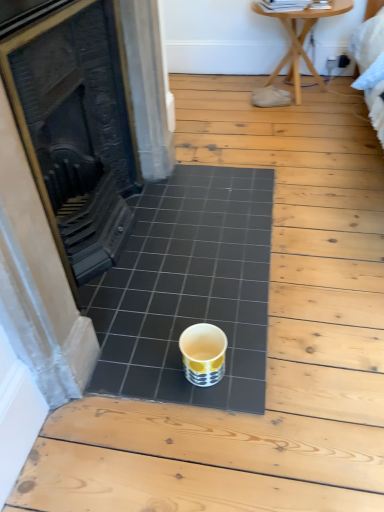
Image resolution: width=384 pixels, height=512 pixels. Identify the location of black cast iron fireplace at center. (76, 131).

The height and width of the screenshot is (512, 384). I want to click on wooden table at upper right, so click(301, 40).

The height and width of the screenshot is (512, 384). Identify the location of black ceramic tile at center. (188, 288).

At what (x,y) coordinates should I click in order to perform the action: click on black cast iron fireplace at center. Please return your answer as a coordinate pair (x, y). This screenshot has height=512, width=384. Looking at the image, I should click on (76, 131).

Is wooden table at upper right at the back of yellow and white ceramic cup at center?

That's not correct — yellow and white ceramic cup at center is not looking away from wooden table at upper right.

Locate an element on the screen. This screenshot has width=384, height=512. coffee cup below the wooden table at upper right (from the image's perspective) is located at coordinates (203, 354).

From a real-world perspective, is yellow and white ceramic cup at center located beneath wooden table at upper right?

Yes, from a real-world perspective, yellow and white ceramic cup at center is beneath wooden table at upper right.

In the scene shown: What's the angular difference between yellow and white ceramic cup at center and wooden table at upper right's facing directions?

They differ by 86.1 degrees in their facing directions.

The image size is (384, 512). In order to click on table on the right of black ceramic tile at center in this screenshot , I will do `click(301, 40)`.

Who is taller, black ceramic tile at center or wooden table at upper right?

wooden table at upper right is taller.

Would you say wooden table at upper right is part of black ceramic tile at center's contents?

No, wooden table at upper right is not a part of black ceramic tile at center.

From the image's perspective, is black ceramic tile at center on top of yellow and white ceramic cup at center?

Correct, black ceramic tile at center appears higher than yellow and white ceramic cup at center in the image.

Is black ceramic tile at center positioned in front of yellow and white ceramic cup at center?

No, the depth of black ceramic tile at center is greater than that of yellow and white ceramic cup at center.

Looking at this image, between black ceramic tile at center and yellow and white ceramic cup at center, which one has larger width?

black ceramic tile at center.

How distant is black ceramic tile at center from yellow and white ceramic cup at center?

black ceramic tile at center and yellow and white ceramic cup at center are 31.44 centimeters apart from each other.

From a real-world perspective, is wooden table at upper right positioned above or below black ceramic tile at center?

wooden table at upper right is situated higher than black ceramic tile at center in the real world.

From the image's perspective, would you say wooden table at upper right is shown under black ceramic tile at center?

Actually, wooden table at upper right appears above black ceramic tile at center in the image.

Considering the relative positions of wooden table at upper right and black ceramic tile at center in the image provided, is wooden table at upper right to the left or to the right of black ceramic tile at center?

From the image, it's evident that wooden table at upper right is to the right of black ceramic tile at center.

Does point (97, 313) come in front of point (91, 222)?

Yes, it is in front of point (91, 222).

From a real-world perspective, is black ceramic tile at center positioned above or below black cast iron fireplace at center?

Clearly, from a real-world perspective, black ceramic tile at center is below black cast iron fireplace at center.

Is black ceramic tile at center to the right of black cast iron fireplace at center from the viewer's perspective?

Yes, black ceramic tile at center is to the right of black cast iron fireplace at center.

Can you tell me how much black ceramic tile at center and black cast iron fireplace at center differ in facing direction?

The angle between the facing direction of black ceramic tile at center and the facing direction of black cast iron fireplace at center is 0.98 degrees.

Is wooden table at upper right located within black cast iron fireplace at center?

No, black cast iron fireplace at center does not contain wooden table at upper right.

From a real-world perspective, is black cast iron fireplace at center above or below wooden table at upper right?

black cast iron fireplace at center is situated higher than wooden table at upper right in the real world.

This screenshot has height=512, width=384. What are the coordinates of `fireplace lying on the left of wooden table at upper right` in the screenshot? It's located at (76, 131).

Is black cast iron fireplace at center oriented towards wooden table at upper right?

No, black cast iron fireplace at center is not aimed at wooden table at upper right.

Is point (222, 340) less distant than point (255, 306)?

Yes, point (222, 340) is closer to viewer.

Is the position of yellow and white ceramic cup at center more distant than that of black ceramic tile at center?

No, yellow and white ceramic cup at center is closer to the viewer.

Could you tell me if yellow and white ceramic cup at center is facing black ceramic tile at center?

No, yellow and white ceramic cup at center does not turn towards black ceramic tile at center.

Is yellow and white ceramic cup at center to the right of black ceramic tile at center from the viewer's perspective?

Indeed, yellow and white ceramic cup at center is positioned on the right side of black ceramic tile at center.

Where is `coffee cup that is in front of the wooden table at upper right`? This screenshot has height=512, width=384. coffee cup that is in front of the wooden table at upper right is located at coordinates (203, 354).

Find the location of a particular element. table behind the black ceramic tile at center is located at coordinates (301, 40).

From the image, which object appears to be farther from yellow and white ceramic cup at center, black ceramic tile at center or black cast iron fireplace at center?

Based on the image, black cast iron fireplace at center appears to be further to yellow and white ceramic cup at center.

When comparing their distances from black ceramic tile at center, does black cast iron fireplace at center or wooden table at upper right seem closer?

Among the two, black cast iron fireplace at center is located nearer to black ceramic tile at center.

Estimate the real-world distances between objects in this image. Which object is closer to black ceramic tile at center, yellow and white ceramic cup at center or wooden table at upper right?

yellow and white ceramic cup at center is positioned closer to the anchor black ceramic tile at center.

When comparing their distances from black ceramic tile at center, does yellow and white ceramic cup at center or black cast iron fireplace at center seem further?

black cast iron fireplace at center.

Looking at the image, which one is located further to black cast iron fireplace at center, yellow and white ceramic cup at center or wooden table at upper right?

wooden table at upper right is positioned further to the anchor black cast iron fireplace at center.

Based on their spatial positions, is yellow and white ceramic cup at center or black cast iron fireplace at center closer to wooden table at upper right?

The object closer to wooden table at upper right is black cast iron fireplace at center.

Based on their spatial positions, is black cast iron fireplace at center or black ceramic tile at center further from yellow and white ceramic cup at center?

black cast iron fireplace at center is positioned further to the anchor yellow and white ceramic cup at center.

Looking at the image, which one is located closer to wooden table at upper right, black ceramic tile at center or black cast iron fireplace at center?

black ceramic tile at center lies closer to wooden table at upper right than the other object.

Where is `ceramic tile between black cast iron fireplace at center and yellow and white ceramic cup at center in the vertical direction`? This screenshot has height=512, width=384. ceramic tile between black cast iron fireplace at center and yellow and white ceramic cup at center in the vertical direction is located at coordinates (188, 288).

Locate an element on the screen. The image size is (384, 512). coffee cup between black cast iron fireplace at center and wooden table at upper right along the z-axis is located at coordinates (203, 354).

Identify the location of ceramic tile between black cast iron fireplace at center and wooden table at upper right along the z-axis. This screenshot has width=384, height=512. (188, 288).

Image resolution: width=384 pixels, height=512 pixels. I want to click on ceramic tile that lies between wooden table at upper right and yellow and white ceramic cup at center from top to bottom, so click(x=188, y=288).